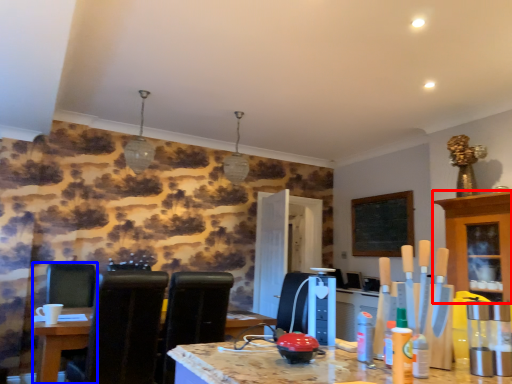
Question: Which object appears farthest to the camera in this image, cabinetry (highlighted by a red box) or chair (highlighted by a blue box)?

Choices:
 (A) cabinetry
 (B) chair

Answer: (B)